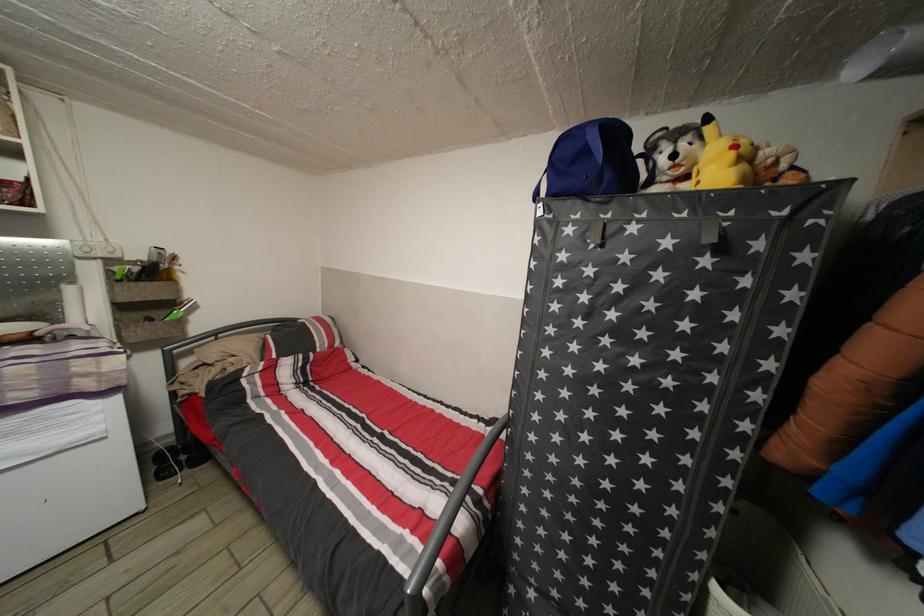
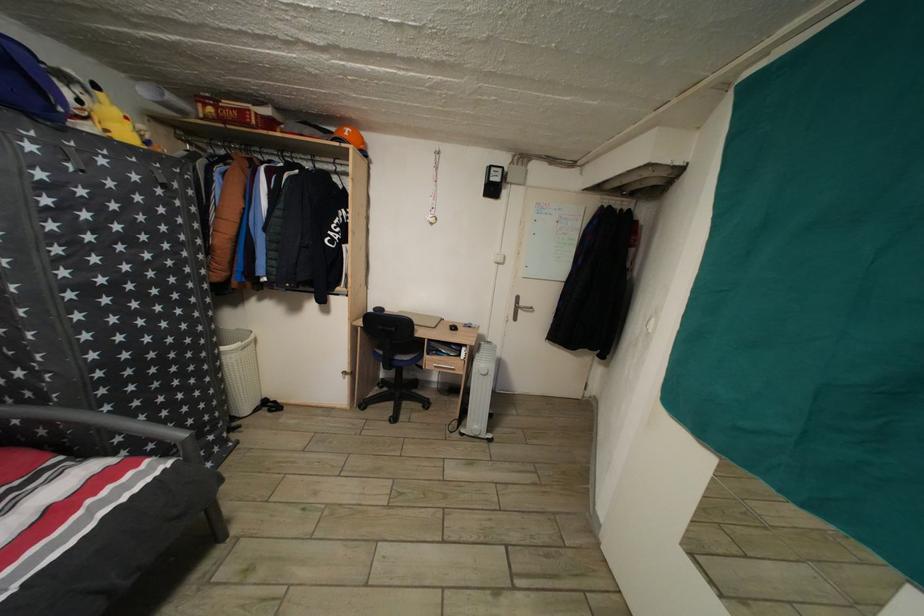
In the second image, find the point that corresponds to (742,153) in the first image.

(134, 124)